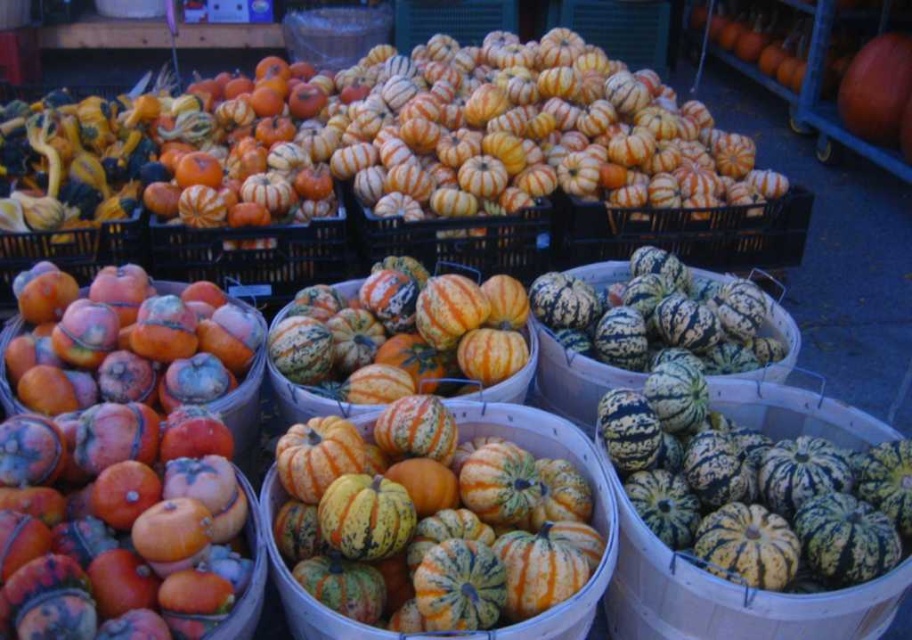
Question: Does green speckled squash at center have a greater width compared to speckled orange gourd at center?

Choices:
 (A) no
 (B) yes

Answer: (A)

Question: Does green speckled squash at center appear on the right side of speckled orange gourd at center?

Choices:
 (A) no
 (B) yes

Answer: (B)

Question: Does green speckled squash at center appear on the left side of green striped gourd at center?

Choices:
 (A) no
 (B) yes

Answer: (A)

Question: Based on their relative distances, which object is farther from the green speckled squash at center?

Choices:
 (A) speckled orange gourd at center
 (B) green striped gourd at center

Answer: (B)

Question: Based on their relative distances, which object is nearer to the speckled orange gourd at center?

Choices:
 (A) green speckled squash at center
 (B) green striped gourd at center

Answer: (A)

Question: Which object appears closest to the camera in this image?

Choices:
 (A) green striped gourd at center
 (B) speckled orange gourd at center

Answer: (B)